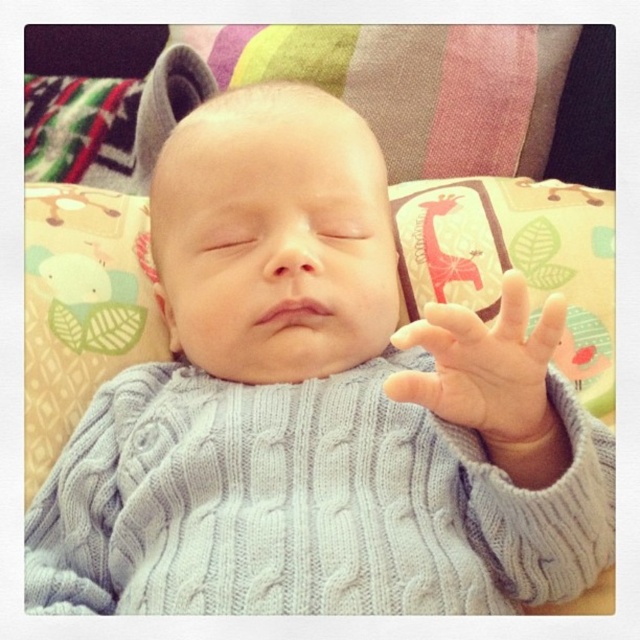
You are a photographer adjusting the focus of your camera. You have two points to focus on in the image, point 1 at coordinates point (237, 166) and point 2 at coordinates point (518, 432). Which point is closer to the camera?

Point (518, 432) is closer to the camera than point (237, 166) because the description states that point (237, 166) is behind point (518, 432).

You are holding a toy that needs to be placed exactly 24 inches away from where you are standing. You see the point at coordinates point (282, 212) in the image. Can you place the toy at that point to meet the requirement?

The distance between point (282, 212) and the viewer is 24.27 inches, which is slightly more than 24 inches. Therefore, placing the toy at point (282, 212) would be just over the required distance.